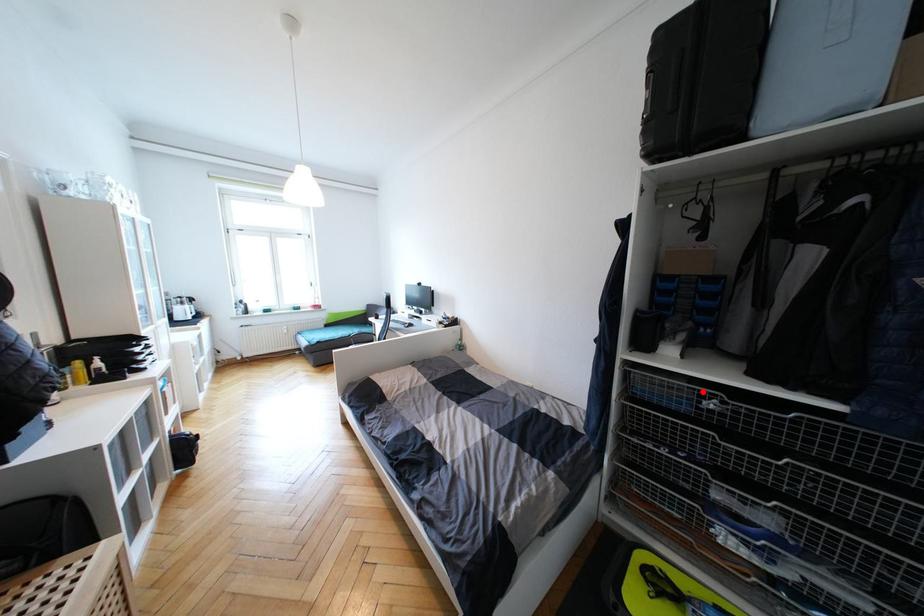
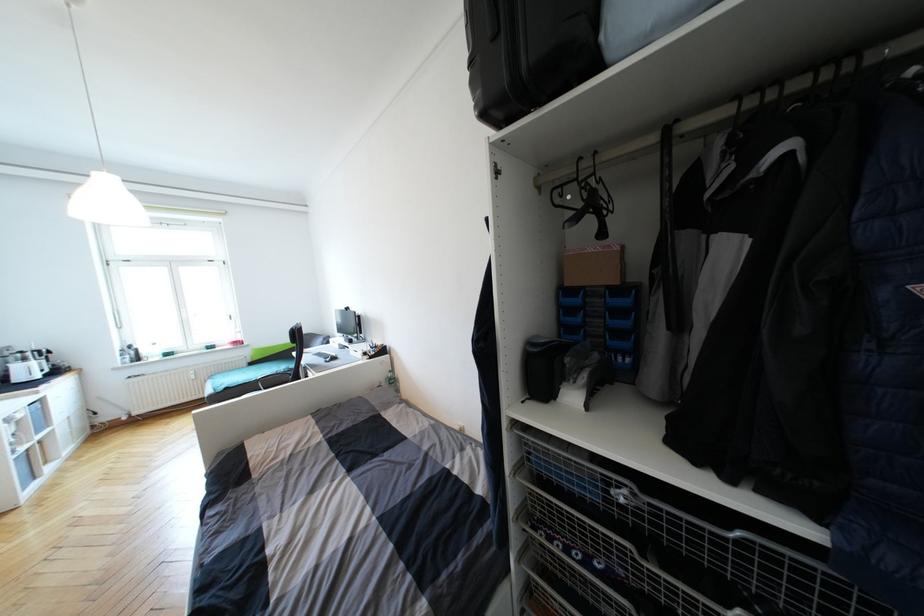
Where in the second image is the point corresponding to the highlighted location from the first image?

(604, 476)